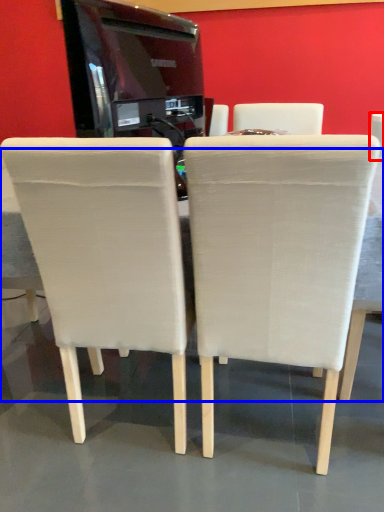
Question: Which object appears farthest to the camera in this image, chair (highlighted by a red box) or table (highlighted by a blue box)?

Choices:
 (A) chair
 (B) table

Answer: (A)